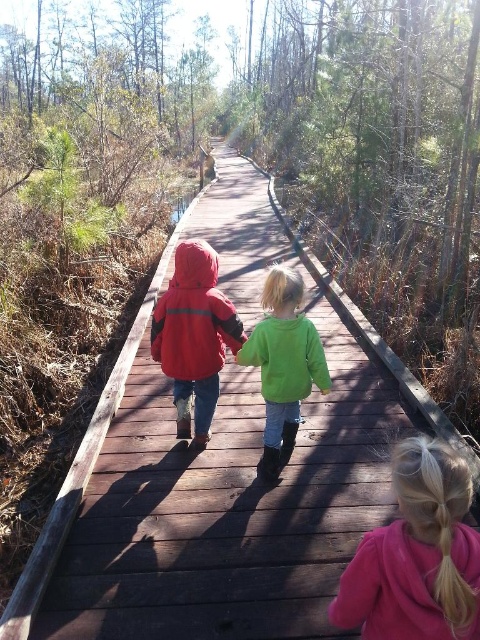
Is pink fleece jacket at lower right to the left of matte red jacket at center from the viewer's perspective?

No, pink fleece jacket at lower right is not to the left of matte red jacket at center.

Which is above, pink fleece jacket at lower right or matte red jacket at center?

matte red jacket at center

Is point (465, 540) positioned behind point (214, 253)?

No, it is not.

The width and height of the screenshot is (480, 640). Find the location of `pink fleece jacket at lower right`. pink fleece jacket at lower right is located at coordinates (417, 556).

Is pink fleece jacket at lower right above green fleece jacket at center?

Incorrect, pink fleece jacket at lower right is not positioned above green fleece jacket at center.

Consider the image. Is pink fleece jacket at lower right thinner than green fleece jacket at center?

Correct, pink fleece jacket at lower right's width is less than green fleece jacket at center's.

The image size is (480, 640). Identify the location of pink fleece jacket at lower right. (417, 556).

The width and height of the screenshot is (480, 640). Identify the location of pink fleece jacket at lower right. (417, 556).

Is pink fleece jacket at lower right to the right of green fuzzy sweater at center from the viewer's perspective?

Indeed, pink fleece jacket at lower right is positioned on the right side of green fuzzy sweater at center.

Which is in front, point (405, 608) or point (276, 308)?

Point (405, 608) is more forward.

Where is `pink fleece jacket at lower right`? Image resolution: width=480 pixels, height=640 pixels. pink fleece jacket at lower right is located at coordinates (417, 556).